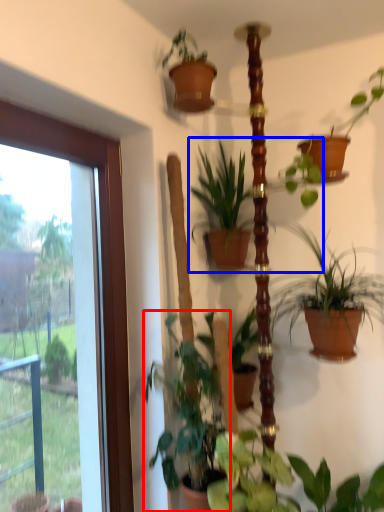
Question: Which of the following is the farthest to the observer, houseplant (highlighted by a red box) or houseplant (highlighted by a blue box)?

Choices:
 (A) houseplant
 (B) houseplant

Answer: (B)